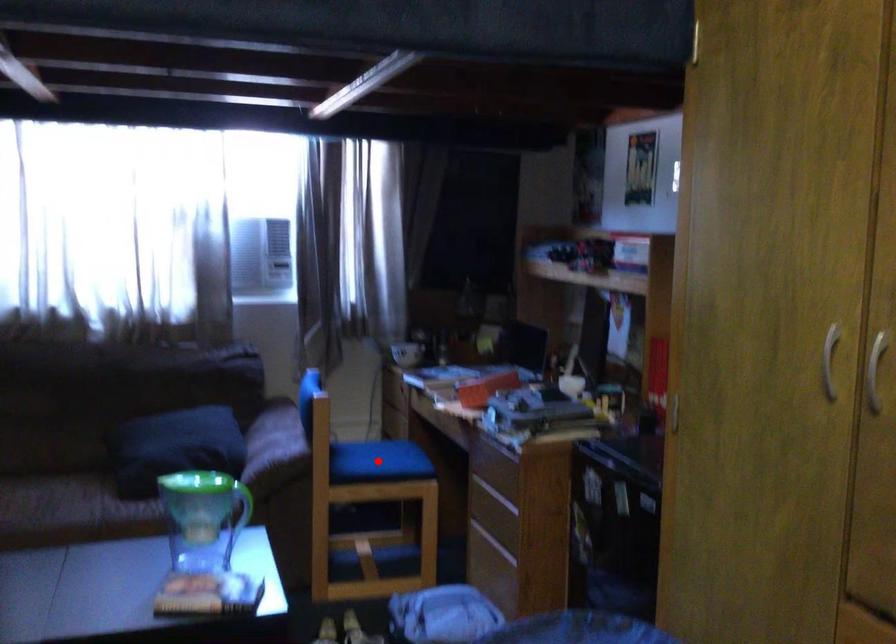
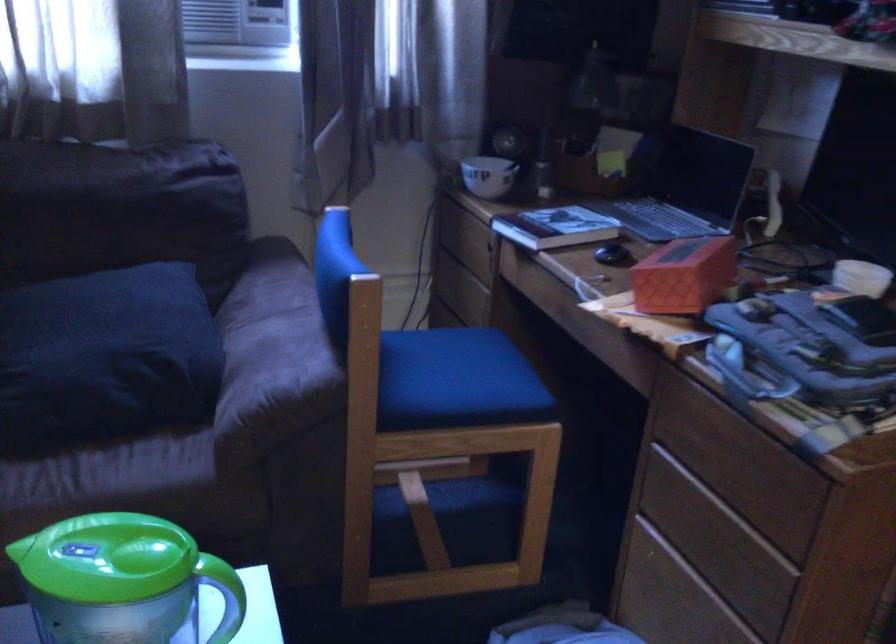
Question: A red point is marked in image1. In image2, is the corresponding 3D point closer to the camera or farther? Reply with the corresponding letter.

Choices:
 (A) The corresponding 3D point is closer.
 (B) The corresponding 3D point is farther.

Answer: (A)